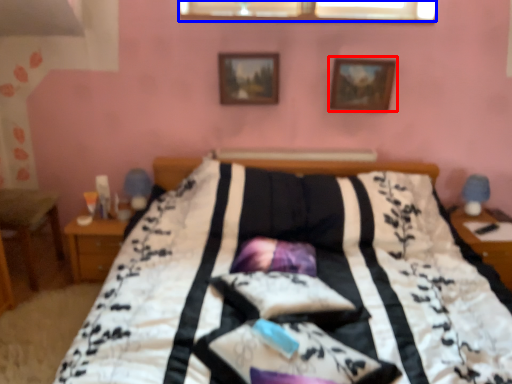
Question: Which object appears farthest to the camera in this image, picture frame (highlighted by a red box) or window (highlighted by a blue box)?

Choices:
 (A) picture frame
 (B) window

Answer: (B)